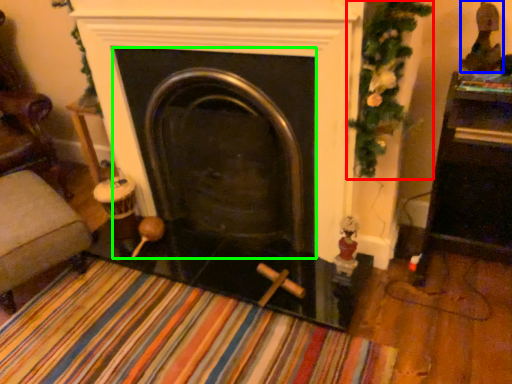
Question: Estimate the real-world distances between objects in this image. Which object is farther from christmas decoration (highlighted by a red box), toy (highlighted by a blue box) or fireplace (highlighted by a green box)?

Choices:
 (A) toy
 (B) fireplace

Answer: (B)